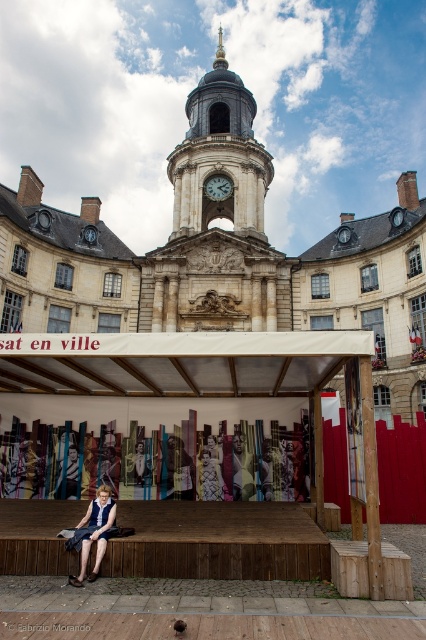
Question: Considering the relative positions of denim skirt at lower left and matte black dress at lower left in the image provided, where is denim skirt at lower left located with respect to matte black dress at lower left?

Choices:
 (A) below
 (B) above

Answer: (A)

Question: Which point is farther to the camera?

Choices:
 (A) [x=152, y=488]
 (B) [x=215, y=198]
 (C) [x=209, y=490]
 (D) [x=83, y=544]

Answer: (B)

Question: Is light beige stone clock tower at center above denim skirt at lower left?

Choices:
 (A) no
 (B) yes

Answer: (B)

Question: Is light beige stone clock tower at center wider than matte black dress at lower left?

Choices:
 (A) yes
 (B) no

Answer: (A)

Question: Estimate the real-world distances between objects in this image. Which object is closer to the denim skirt at lower left?

Choices:
 (A) brass clock face at upper center
 (B) white textured dress at center
 (C) light beige stone clock tower at center

Answer: (B)

Question: Which object appears farthest from the camera in this image?

Choices:
 (A) light beige stone clock tower at center
 (B) denim skirt at lower left

Answer: (A)